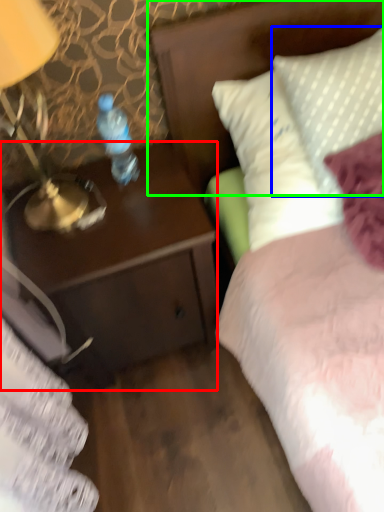
Question: Considering the real-world distances, which object is farthest from desk (highlighted by a red box)? pillow (highlighted by a blue box) or headboard (highlighted by a green box)?

Choices:
 (A) pillow
 (B) headboard

Answer: (A)